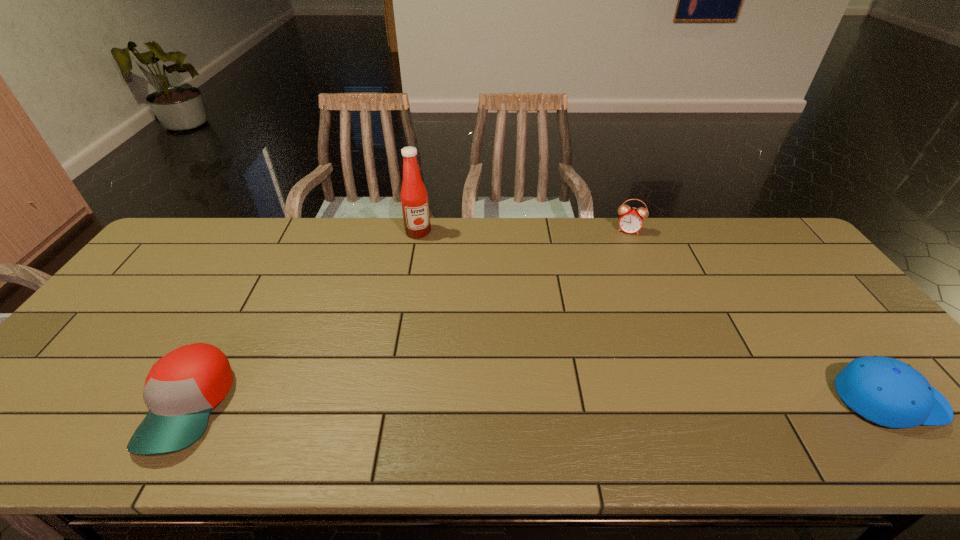
Where is `condiment that is at the far edge`? condiment that is at the far edge is located at coordinates pyautogui.click(x=414, y=199).

At what (x,y) coordinates should I click in order to perform the action: click on alarm clock that is positioned at the far edge. Please return your answer as a coordinate pair (x, y). The width and height of the screenshot is (960, 540). Looking at the image, I should click on (631, 221).

At what (x,y) coordinates should I click in order to perform the action: click on object situated at the near edge. Please return your answer as a coordinate pair (x, y). The width and height of the screenshot is (960, 540). Looking at the image, I should click on (182, 388).

The image size is (960, 540). In order to click on free space at the far edge in this screenshot , I will do `click(673, 249)`.

Where is `vacant space at the near edge`? vacant space at the near edge is located at coordinates (462, 391).

The image size is (960, 540). In the image, there is a desktop. In order to click on vacant space at the left edge in this screenshot , I will do `click(161, 272)`.

This screenshot has height=540, width=960. In the image, there is a desktop. What are the coordinates of `vacant space at the right edge` in the screenshot? It's located at (818, 343).

The image size is (960, 540). Find the location of `vacant area at the far right corner`. vacant area at the far right corner is located at coordinates (740, 218).

I want to click on vacant area between the third object from right to left and the alarm clock, so click(523, 231).

Locate an element on the screen. This screenshot has width=960, height=540. free spot between the alarm clock and the leftmost object is located at coordinates (409, 318).